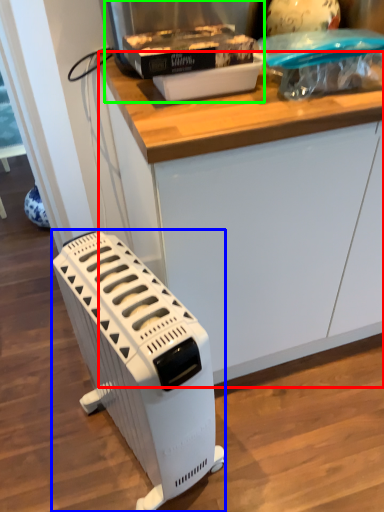
Question: Considering the real-world distances, which object is farthest from counter (highlighted by a red box)? home appliance (highlighted by a blue box) or appliance (highlighted by a green box)?

Choices:
 (A) home appliance
 (B) appliance

Answer: (A)